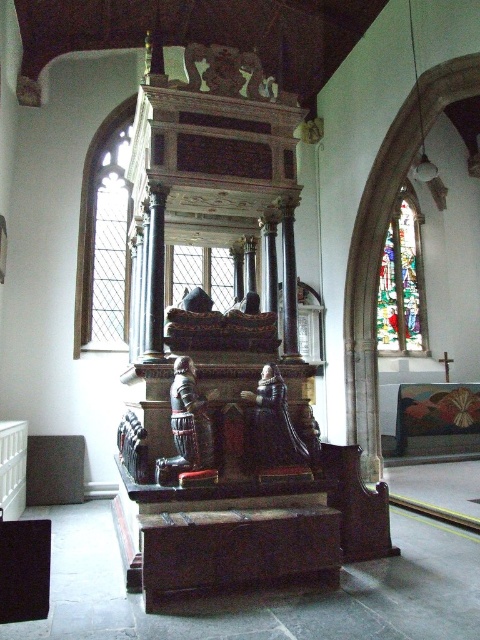
Is polished dark wood statue at center smaller than clear glass window at center?

Yes.

Which is more to the left, polished dark wood statue at center or clear glass window at center?

From the viewer's perspective, clear glass window at center appears more on the left side.

Is point (256, 435) closer to viewer compared to point (217, 268)?

Yes, point (256, 435) is closer to viewer.

Locate an element on the screen. The image size is (480, 640). polished dark wood statue at center is located at coordinates (273, 428).

Can you confirm if stained glass window at upper right is positioned above clear glass window at center?

Correct, stained glass window at upper right is located above clear glass window at center.

From the picture: Does stained glass window at upper right have a lesser height compared to clear glass window at center?

No, stained glass window at upper right is not shorter than clear glass window at center.

Does point (406, 300) come in front of point (192, 269)?

No, it is behind (192, 269).

Locate an element on the screen. stained glass window at upper right is located at coordinates (402, 282).

Is polished dark wood statue at center thinner than wooden statue at center?

In fact, polished dark wood statue at center might be wider than wooden statue at center.

Who is higher up, polished dark wood statue at center or wooden statue at center?

Positioned higher is wooden statue at center.

Is point (272, 410) positioned before point (179, 451)?

No.

The image size is (480, 640). What are the coordinates of `polished dark wood statue at center` in the screenshot? It's located at 273,428.